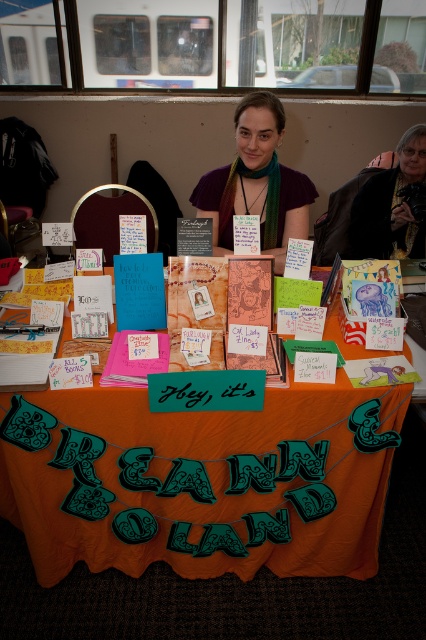
You are organizing a craft fair booth and need to decide where to place a new item. The orange fabric at center and the green knitted scarf at center are already on the table. Which object should you place the new item next to if you want it to be more noticeable?

The orange fabric at center is larger than the green knitted scarf at center, so placing the new item next to the orange fabric at center would make it more noticeable due to its size.

You are a customer at the craft fair and want to buy both the green knitted scarf at center and the dark brown leather jacket at upper right. If you place them side by side on the table, how much space will they occupy in total?

The green knitted scarf at center is 22.59 inches from the dark brown leather jacket at upper right. When placed side by side, the total space they occupy would be approximately 22.59 inches.

You are a customer at the craft fair and want to buy a zine. The vendor tells you that the orange fabric at center is where the payment counter is located. If you are standing at the point marked by the coordinate point (201, 481), which is the orange fabric at center, can you reach the zines displayed on the table without moving from your current position?

The orange fabric at center is represented by point (201, 481), so if you are standing at that coordinate, you are already at the payment counter location. However, the zines are displayed on the same table, so you can reach them without moving from your current position as they are on the same surface.